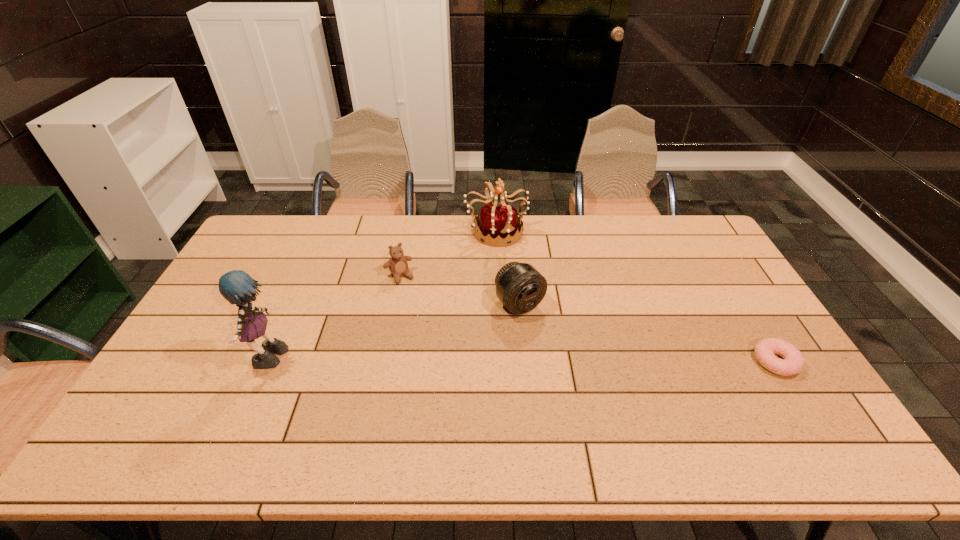
Identify the location of free space located 0.190m on the front-facing side of the leftmost object. (182, 362).

In order to click on free space located 0.080m on the front-facing side of the leftmost object in this screenshot , I will do `click(223, 362)`.

Image resolution: width=960 pixels, height=540 pixels. I want to click on vacant space located on the front-facing side of the leftmost object, so click(x=211, y=362).

Locate an element on the screen. vacant position located on the left of the doughnut is located at coordinates (729, 361).

You are a GUI agent. You are given a task and a screenshot of the screen. Output one action in this format:
    pyautogui.click(x=<x>, y=<y>)
    Task: Click on the blank space located on the front-facing side of the teddy bear
    Image resolution: width=960 pixels, height=540 pixels.
    Given the screenshot: What is the action you would take?
    pyautogui.click(x=436, y=336)

Identify the location of vacant region located on the front-facing side of the teddy bear. (419, 307).

Where is `vacant space located on the front-facing side of the teddy bear`? The height and width of the screenshot is (540, 960). vacant space located on the front-facing side of the teddy bear is located at coordinates (421, 312).

Where is `blank space located 0.260m on the front-facing side of the third tallest object`? This screenshot has height=540, width=960. blank space located 0.260m on the front-facing side of the third tallest object is located at coordinates (592, 382).

Identify the location of vacant region located on the front-facing side of the third tallest object. This screenshot has width=960, height=540. point(622,414).

Image resolution: width=960 pixels, height=540 pixels. Find the location of `free point located on the front-facing side of the third tallest object`. free point located on the front-facing side of the third tallest object is located at coordinates (611, 402).